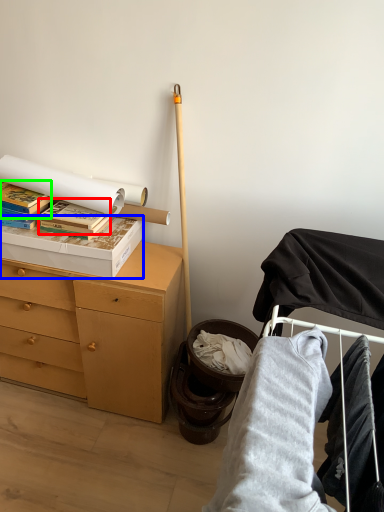
Question: Which is farther away from paperback book (highlighted by a red box)? box (highlighted by a blue box) or paperback book (highlighted by a green box)?

Choices:
 (A) box
 (B) paperback book

Answer: (B)